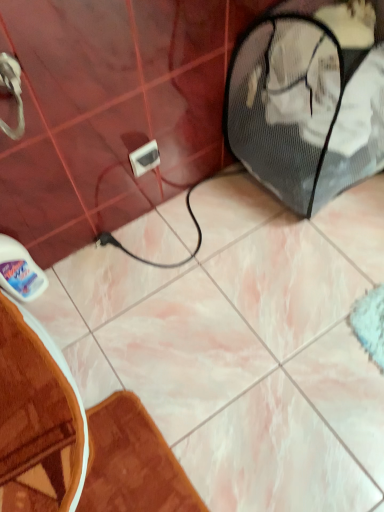
Question: Would you say brown textured bath mat at lower left is outside white plastic outlet at center?

Choices:
 (A) no
 (B) yes

Answer: (B)

Question: Can you confirm if brown textured bath mat at lower left is bigger than white plastic outlet at center?

Choices:
 (A) yes
 (B) no

Answer: (A)

Question: Does brown textured bath mat at lower left have a smaller size compared to white plastic outlet at center?

Choices:
 (A) yes
 (B) no

Answer: (B)

Question: Does brown textured bath mat at lower left turn towards white plastic outlet at center?

Choices:
 (A) no
 (B) yes

Answer: (A)

Question: Are brown textured bath mat at lower left and white plastic outlet at center beside each other?

Choices:
 (A) no
 (B) yes

Answer: (A)

Question: Considering the relative sizes of brown textured bath mat at lower left and white plastic outlet at center in the image provided, is brown textured bath mat at lower left thinner than white plastic outlet at center?

Choices:
 (A) yes
 (B) no

Answer: (B)

Question: Is white plastic outlet at center touching brown textured bath mat at lower left?

Choices:
 (A) no
 (B) yes

Answer: (A)

Question: Does white plastic outlet at center have a smaller size compared to brown textured bath mat at lower left?

Choices:
 (A) yes
 (B) no

Answer: (A)

Question: Does white plastic outlet at center contain brown textured bath mat at lower left?

Choices:
 (A) no
 (B) yes

Answer: (A)

Question: Is white plastic outlet at center outside brown textured bath mat at lower left?

Choices:
 (A) yes
 (B) no

Answer: (A)

Question: From a real-world perspective, is white plastic outlet at center on brown textured bath mat at lower left?

Choices:
 (A) no
 (B) yes

Answer: (B)

Question: Considering the relative positions of white plastic outlet at center and brown textured bath mat at lower left in the image provided, is white plastic outlet at center behind brown textured bath mat at lower left?

Choices:
 (A) no
 (B) yes

Answer: (B)

Question: Is white plastic outlet at center taller or shorter than brown textured bath mat at lower left?

Choices:
 (A) tall
 (B) short

Answer: (A)